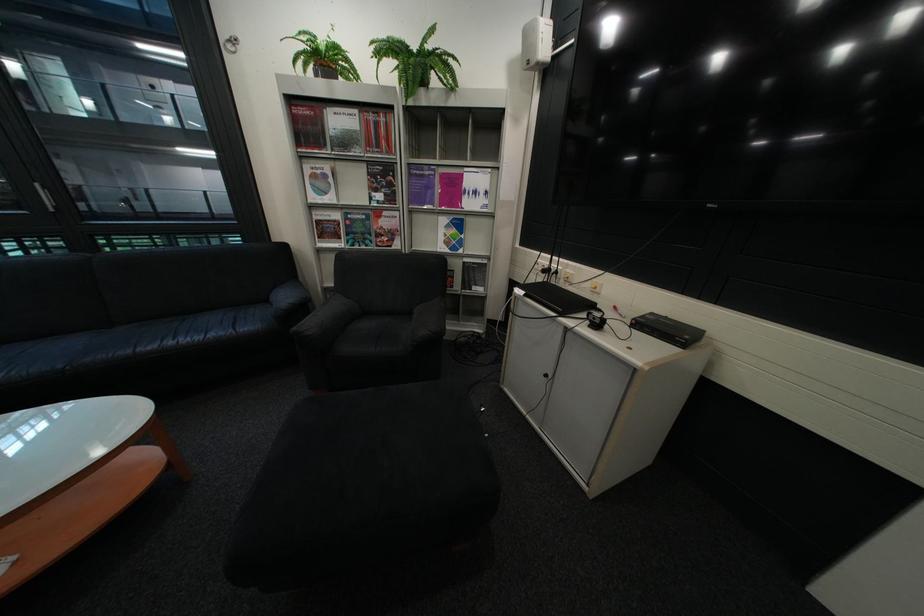
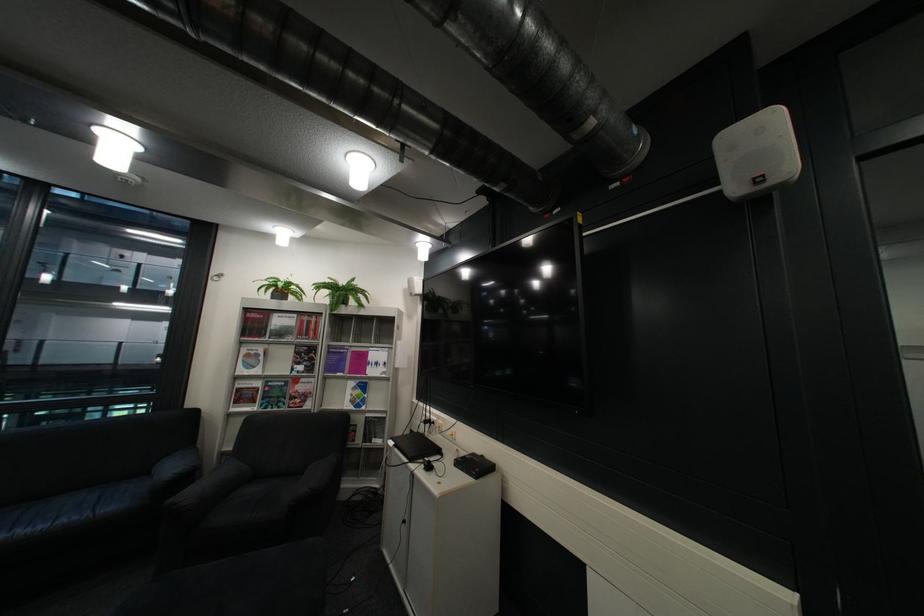
The point at (x=373, y=229) is marked in the first image. Where is the corresponding point in the second image?

(290, 394)